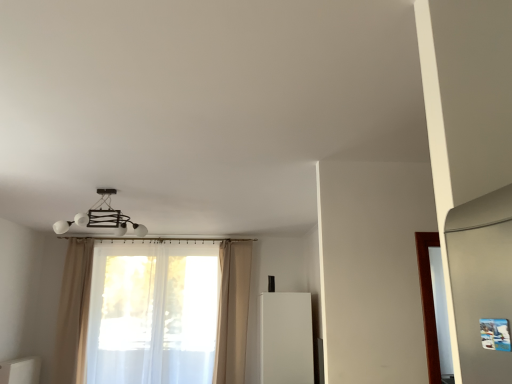
Locate an element on the screen. This screenshot has height=384, width=512. matte white chandelier at upper center is located at coordinates (102, 217).

Image resolution: width=512 pixels, height=384 pixels. Describe the element at coordinates (286, 338) in the screenshot. I see `white matte refrigerator at center` at that location.

What do you see at coordinates (233, 311) in the screenshot? I see `translucent white curtain at center, which ranks as the 2th curtain in right-to-left order` at bounding box center [233, 311].

Where is `beige fabric curtain at center, which is the first curtain from right to left`? This screenshot has height=384, width=512. beige fabric curtain at center, which is the first curtain from right to left is located at coordinates (232, 311).

Which object is thinner, white matte refrigerator at center or matte white chandelier at upper center?

white matte refrigerator at center.

From the picture: Is matte white chandelier at upper center at the back of white matte refrigerator at center?

white matte refrigerator at center does not have its back to matte white chandelier at upper center.

Image resolution: width=512 pixels, height=384 pixels. I want to click on lamp located above the white matte refrigerator at center (from the image's perspective), so click(x=102, y=217).

Which is correct: beige fabric curtain at left, which is the third curtain in right-to-left order, is inside beige fabric curtain at center, which is the first curtain from right to left, or outside of it?

beige fabric curtain at left, which is the third curtain in right-to-left order, is not enclosed by beige fabric curtain at center, which is the first curtain from right to left.

Is beige fabric curtain at left, the 1th curtain in the left-to-right sequence, to the left of beige fabric curtain at center, acting as the third curtain starting from the left, from the viewer's perspective?

Yes, beige fabric curtain at left, the 1th curtain in the left-to-right sequence, is to the left of beige fabric curtain at center, acting as the third curtain starting from the left.

Which object is thinner, beige fabric curtain at left, which is the third curtain in right-to-left order, or beige fabric curtain at center, acting as the third curtain starting from the left?

beige fabric curtain at left, which is the third curtain in right-to-left order, is thinner.

Does beige fabric curtain at left, which is the third curtain in right-to-left order, come in front of beige fabric curtain at center, which is the first curtain from right to left?

Yes, beige fabric curtain at left, which is the third curtain in right-to-left order, is in front of beige fabric curtain at center, which is the first curtain from right to left.

Looking at this image, which point is more forward, (x=145, y=233) or (x=260, y=380)?

Answer: The point (x=260, y=380) is closer to the camera.

Is matte white chandelier at upper center facing away from white matte refrigerator at center?

That's not correct — matte white chandelier at upper center is not looking away from white matte refrigerator at center.

Considering the relative sizes of matte white chandelier at upper center and white matte refrigerator at center in the image provided, is matte white chandelier at upper center shorter than white matte refrigerator at center?

Correct, matte white chandelier at upper center is not as tall as white matte refrigerator at center.

From the picture: Considering the relative positions of matte white chandelier at upper center and white matte refrigerator at center in the image provided, is matte white chandelier at upper center to the right of white matte refrigerator at center from the viewer's perspective?

Incorrect, matte white chandelier at upper center is not on the right side of white matte refrigerator at center.

Which point is more forward, [83,354] or [224,313]?

The point [224,313] is closer to the camera.

Is translucent white curtain at center, which ranks as the 2th curtain in right-to-left order, far away from beige fabric curtain at center, acting as the third curtain starting from the left?

Yes.

Can you tell me how much translucent white curtain at center, which ranks as the 2th curtain in right-to-left order, and beige fabric curtain at center, acting as the third curtain starting from the left, differ in facing direction?

translucent white curtain at center, which ranks as the 2th curtain in right-to-left order, and beige fabric curtain at center, acting as the third curtain starting from the left, are facing 9.29e-05 degrees away from each other.

Measure the distance between translucent white curtain at center, acting as the second curtain starting from the left, and beige fabric curtain at center, acting as the third curtain starting from the left.

They are 6.51 feet apart.

Who is taller, white matte refrigerator at center or beige fabric curtain at center, acting as the third curtain starting from the left?

With more height is beige fabric curtain at center, acting as the third curtain starting from the left.

The height and width of the screenshot is (384, 512). I want to click on appliance in front of the beige fabric curtain at center, acting as the third curtain starting from the left, so click(x=286, y=338).

Is white matte refrigerator at center not within beige fabric curtain at center, acting as the third curtain starting from the left?

white matte refrigerator at center is positioned outside beige fabric curtain at center, acting as the third curtain starting from the left.

From the image's perspective, which one is positioned higher, white matte refrigerator at center or beige fabric curtain at center, which is the first curtain from right to left?

beige fabric curtain at center, which is the first curtain from right to left.

How far apart are beige fabric curtain at left, which is the third curtain in right-to-left order, and white glossy cabinet at lower left?

beige fabric curtain at left, which is the third curtain in right-to-left order, and white glossy cabinet at lower left are 25.42 inches apart.

This screenshot has height=384, width=512. I want to click on furniture that is below the beige fabric curtain at left, the 1th curtain in the left-to-right sequence (from the image's perspective), so click(20, 371).

Does beige fabric curtain at left, which is the third curtain in right-to-left order, appear on the right side of white glossy cabinet at lower left?

Indeed, beige fabric curtain at left, which is the third curtain in right-to-left order, is positioned on the right side of white glossy cabinet at lower left.

Does point (74, 364) come closer to viewer compared to point (33, 370)?

No, it is not.

From the image's perspective, is white glossy cabinet at lower left on translucent white curtain at center, which ranks as the 2th curtain in right-to-left order?

Incorrect, from the image's perspective, white glossy cabinet at lower left is lower than translucent white curtain at center, which ranks as the 2th curtain in right-to-left order.

Do you think white glossy cabinet at lower left is within translucent white curtain at center, which ranks as the 2th curtain in right-to-left order, or outside of it?

white glossy cabinet at lower left cannot be found inside translucent white curtain at center, which ranks as the 2th curtain in right-to-left order.

From a real-world perspective, between white glossy cabinet at lower left and translucent white curtain at center, acting as the second curtain starting from the left, who is vertically higher?

translucent white curtain at center, acting as the second curtain starting from the left, from a real-world perspective.

Can you confirm if white glossy cabinet at lower left is wider than translucent white curtain at center, acting as the second curtain starting from the left?

Indeed, white glossy cabinet at lower left has a greater width compared to translucent white curtain at center, acting as the second curtain starting from the left.

Where is `appliance behind the matte white chandelier at upper center`? appliance behind the matte white chandelier at upper center is located at coordinates (286, 338).

Locate an element on the screen. curtain above the beige fabric curtain at center, acting as the third curtain starting from the left (from the image's perspective) is located at coordinates (74, 313).

Considering their positions, is white matte refrigerator at center positioned further to beige fabric curtain at left, which is the third curtain in right-to-left order, than beige fabric curtain at center, which is the first curtain from right to left?

The object further to beige fabric curtain at left, which is the third curtain in right-to-left order, is white matte refrigerator at center.

Looking at the image, which one is located further to beige fabric curtain at center, which is the first curtain from right to left, white glossy cabinet at lower left or translucent white curtain at center, which ranks as the 2th curtain in right-to-left order?

white glossy cabinet at lower left is positioned further to the anchor beige fabric curtain at center, which is the first curtain from right to left.

From the image, which object appears to be nearer to matte white chandelier at upper center, beige fabric curtain at left, which is the third curtain in right-to-left order, or white matte refrigerator at center?

The object closer to matte white chandelier at upper center is beige fabric curtain at left, which is the third curtain in right-to-left order.

Consider the image. Based on their spatial positions, is matte white chandelier at upper center or translucent white curtain at center, which ranks as the 2th curtain in right-to-left order, closer to beige fabric curtain at left, the 1th curtain in the left-to-right sequence?

translucent white curtain at center, which ranks as the 2th curtain in right-to-left order, is closer to beige fabric curtain at left, the 1th curtain in the left-to-right sequence.

Considering their positions, is white matte refrigerator at center positioned further to beige fabric curtain at left, the 1th curtain in the left-to-right sequence, than matte white chandelier at upper center?

white matte refrigerator at center.

Based on the photo, estimate the real-world distances between objects in this image. Which object is closer to matte white chandelier at upper center, white matte refrigerator at center or translucent white curtain at center, which ranks as the 2th curtain in right-to-left order?

The object closer to matte white chandelier at upper center is translucent white curtain at center, which ranks as the 2th curtain in right-to-left order.

When comparing their distances from matte white chandelier at upper center, does beige fabric curtain at left, which is the third curtain in right-to-left order, or beige fabric curtain at center, acting as the third curtain starting from the left, seem closer?

The object closer to matte white chandelier at upper center is beige fabric curtain at left, which is the third curtain in right-to-left order.

When comparing their distances from white glossy cabinet at lower left, does white matte refrigerator at center or translucent white curtain at center, acting as the second curtain starting from the left, seem closer?

Based on the image, translucent white curtain at center, acting as the second curtain starting from the left, appears to be nearer to white glossy cabinet at lower left.

Locate an element on the screen. lamp between white glossy cabinet at lower left and white matte refrigerator at center is located at coordinates (102, 217).

Image resolution: width=512 pixels, height=384 pixels. Find the location of `lamp between beige fabric curtain at left, which is the third curtain in right-to-left order, and white matte refrigerator at center from left to right`. lamp between beige fabric curtain at left, which is the third curtain in right-to-left order, and white matte refrigerator at center from left to right is located at coordinates (102, 217).

At what (x,y) coordinates should I click in order to perform the action: click on curtain between matte white chandelier at upper center and beige fabric curtain at center, acting as the third curtain starting from the left, along the z-axis. Please return your answer as a coordinate pair (x, y). The height and width of the screenshot is (384, 512). Looking at the image, I should click on click(74, 313).

The width and height of the screenshot is (512, 384). I want to click on curtain between white glossy cabinet at lower left and translucent white curtain at center, acting as the second curtain starting from the left, from left to right, so click(x=74, y=313).